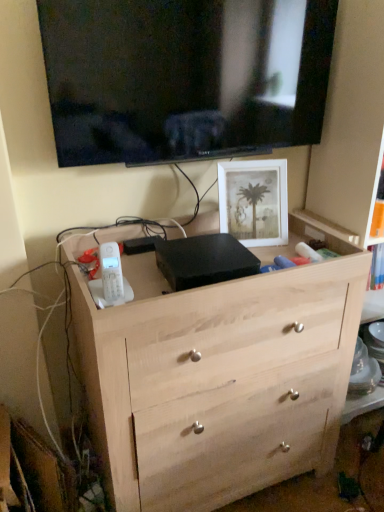
Question: Is black glossy tv at upper center outside of natural wood chest of drawers at center?

Choices:
 (A) yes
 (B) no

Answer: (A)

Question: Considering the relative positions of black glossy tv at upper center and natural wood chest of drawers at center in the image provided, is black glossy tv at upper center behind natural wood chest of drawers at center?

Choices:
 (A) no
 (B) yes

Answer: (B)

Question: Does black glossy tv at upper center appear on the left side of natural wood chest of drawers at center?

Choices:
 (A) no
 (B) yes

Answer: (B)

Question: Considering the relative sizes of black glossy tv at upper center and natural wood chest of drawers at center in the image provided, is black glossy tv at upper center smaller than natural wood chest of drawers at center?

Choices:
 (A) no
 (B) yes

Answer: (B)

Question: From a real-world perspective, is black glossy tv at upper center physically above natural wood chest of drawers at center?

Choices:
 (A) no
 (B) yes

Answer: (B)

Question: Is black glossy tv at upper center thinner than natural wood chest of drawers at center?

Choices:
 (A) yes
 (B) no

Answer: (A)

Question: Can black glossy tv at upper center be found inside white matte picture frame at upper right?

Choices:
 (A) no
 (B) yes

Answer: (A)

Question: Considering the relative sizes of white matte picture frame at upper right and black glossy tv at upper center in the image provided, is white matte picture frame at upper right smaller than black glossy tv at upper center?

Choices:
 (A) yes
 (B) no

Answer: (A)

Question: Is white matte picture frame at upper right positioned beyond the bounds of black glossy tv at upper center?

Choices:
 (A) no
 (B) yes

Answer: (B)

Question: From the image's perspective, would you say white matte picture frame at upper right is positioned over black glossy tv at upper center?

Choices:
 (A) no
 (B) yes

Answer: (A)

Question: Is white matte picture frame at upper right not close to black glossy tv at upper center?

Choices:
 (A) yes
 (B) no

Answer: (B)

Question: From a real-world perspective, is white matte picture frame at upper right located beneath black glossy tv at upper center?

Choices:
 (A) yes
 (B) no

Answer: (A)

Question: From a real-world perspective, does natural wood chest of drawers at center sit lower than white matte picture frame at upper right?

Choices:
 (A) no
 (B) yes

Answer: (B)